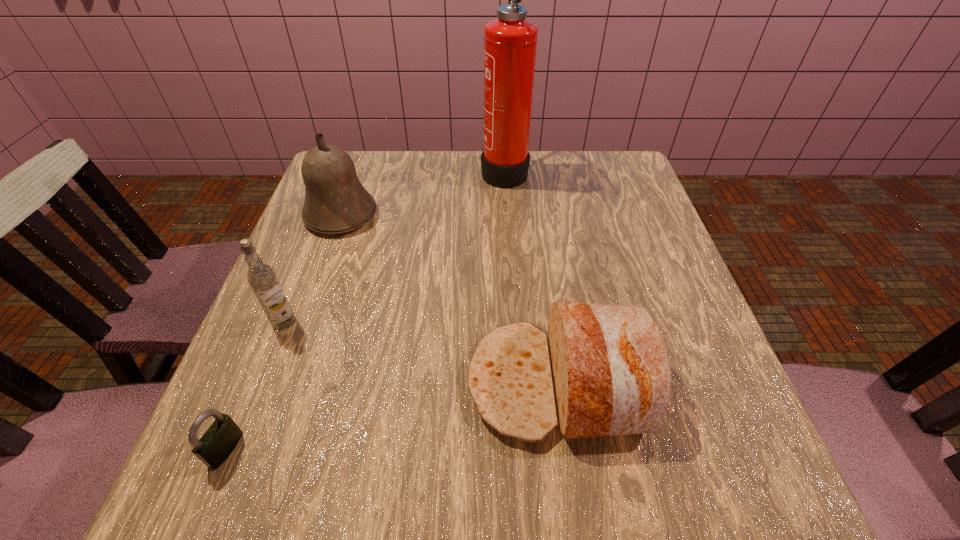
I want to click on fire extinguisher, so click(510, 41).

Where is `the tallest object`? This screenshot has height=540, width=960. the tallest object is located at coordinates (510, 41).

The width and height of the screenshot is (960, 540). I want to click on bell, so click(336, 202).

Locate an element on the screen. vodka is located at coordinates (262, 278).

The image size is (960, 540). Identify the location of bread. (604, 370).

The image size is (960, 540). Identify the location of padlock. (220, 439).

Locate an element on the screen. The height and width of the screenshot is (540, 960). free space located 0.350m on the front-facing side of the farthest object is located at coordinates [x=351, y=170].

Locate an element on the screen. The width and height of the screenshot is (960, 540). blank space located on the front-facing side of the farthest object is located at coordinates (377, 170).

Find the location of a particular element. Image resolution: width=960 pixels, height=540 pixels. vacant point located 0.390m on the front-facing side of the farthest object is located at coordinates (337, 170).

Find the location of a particular element. vacant space located 0.110m on the back of the fourth nearest object is located at coordinates (357, 170).